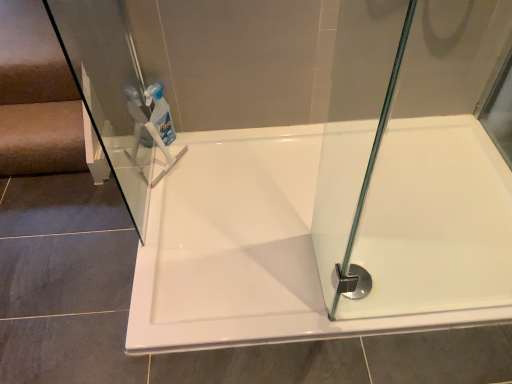
Where is `vacant point to the right of polished chrome shower at bottom right`? vacant point to the right of polished chrome shower at bottom right is located at coordinates (401, 277).